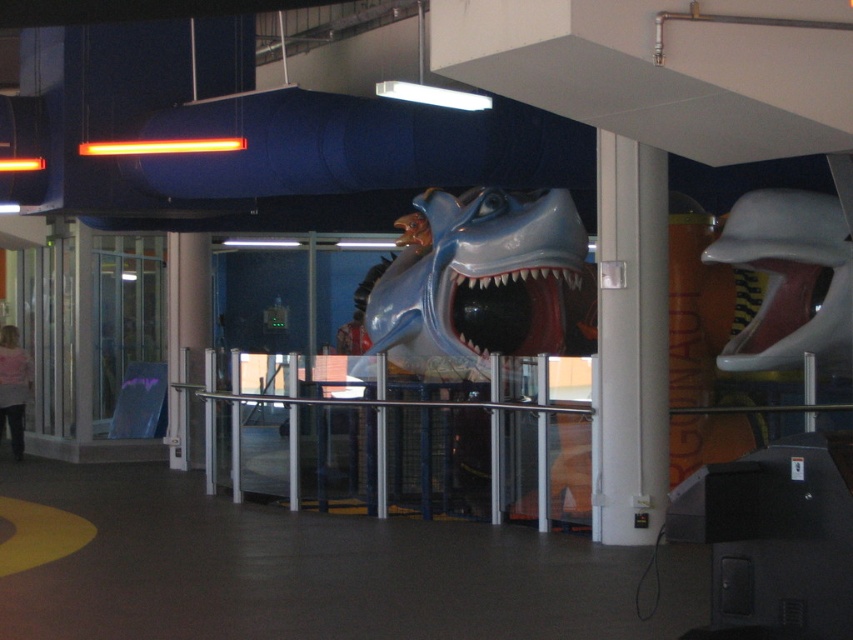
Describe the element at coordinates (630, 342) in the screenshot. The width and height of the screenshot is (853, 640). I see `white glossy pillar at center` at that location.

Can you confirm if white glossy pillar at center is positioned above shiny blue mouth at center?

No, white glossy pillar at center is not above shiny blue mouth at center.

Image resolution: width=853 pixels, height=640 pixels. I want to click on white glossy pillar at center, so click(630, 342).

Where is `white glossy pillar at center`? white glossy pillar at center is located at coordinates (630, 342).

Can you confirm if shiny blue plastic shark at center is shorter than white glossy pillar at center?

Yes, shiny blue plastic shark at center is shorter than white glossy pillar at center.

Can you confirm if shiny blue plastic shark at center is taller than white glossy pillar at center?

Incorrect, shiny blue plastic shark at center's height is not larger of white glossy pillar at center's.

Is point (578, 301) positioned behind point (616, 336)?

Yes, point (578, 301) is behind point (616, 336).

Where is `shiny blue plastic shark at center`? shiny blue plastic shark at center is located at coordinates (485, 285).

Is point (556, 266) in front of point (584, 284)?

Yes.

Which is more to the left, shiny blue plastic shark at center or shiny blue mouth at center?

From the viewer's perspective, shiny blue plastic shark at center appears more on the left side.

What do you see at coordinates (485, 285) in the screenshot? I see `shiny blue plastic shark at center` at bounding box center [485, 285].

Locate an element on the screen. This screenshot has height=640, width=853. shiny blue plastic shark at center is located at coordinates (485, 285).